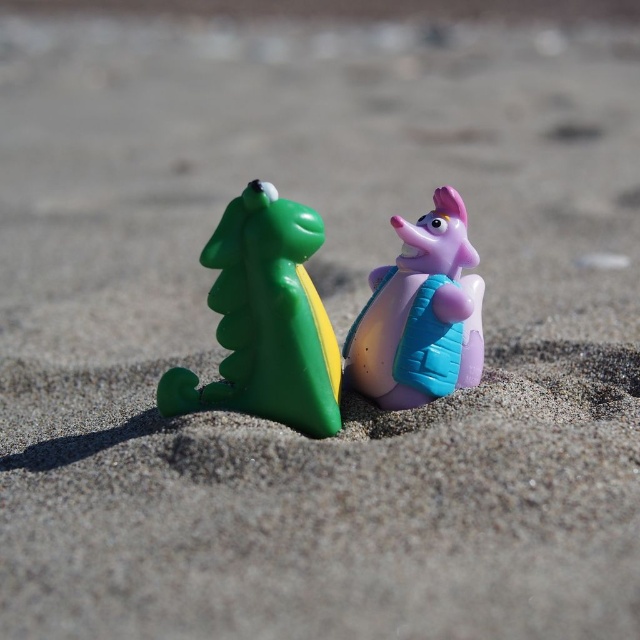
Can you confirm if green plastic dinosaur at left is thinner than glossy plastic snail at center?

No.

Does point (305, 333) lie in front of point (406, 358)?

Yes.

Identify the location of green plastic dinosaur at left. pos(266,320).